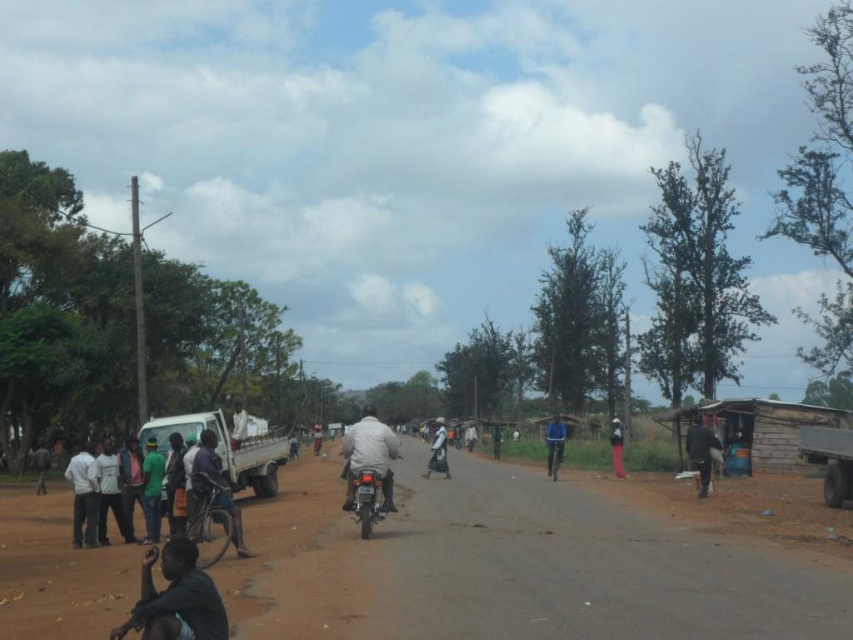
Question: Which object is closer to the camera taking this photo?

Choices:
 (A) brown dirt track at lower left
 (B) dark gray fabric shirt at center

Answer: (A)

Question: Does light brown leather jacket at center come behind white matte shirt at left?

Choices:
 (A) yes
 (B) no

Answer: (B)

Question: Which of the following is the closest to the observer?

Choices:
 (A) blue fabric shirt at center
 (B) dark red fabric pants at right
 (C) dark gray fabric shirt at center
 (D) white matte shirt at left

Answer: (D)

Question: Is brown dirt track at lower left wider than dark skin person at center?

Choices:
 (A) no
 (B) yes

Answer: (B)

Question: Is brown dirt track at lower left below blue fabric shirt at center?

Choices:
 (A) no
 (B) yes

Answer: (A)

Question: Which is farther from the white fabric motorcyclist at center?

Choices:
 (A) green matte shirt at left
 (B) dark gray fabric at lower left

Answer: (B)